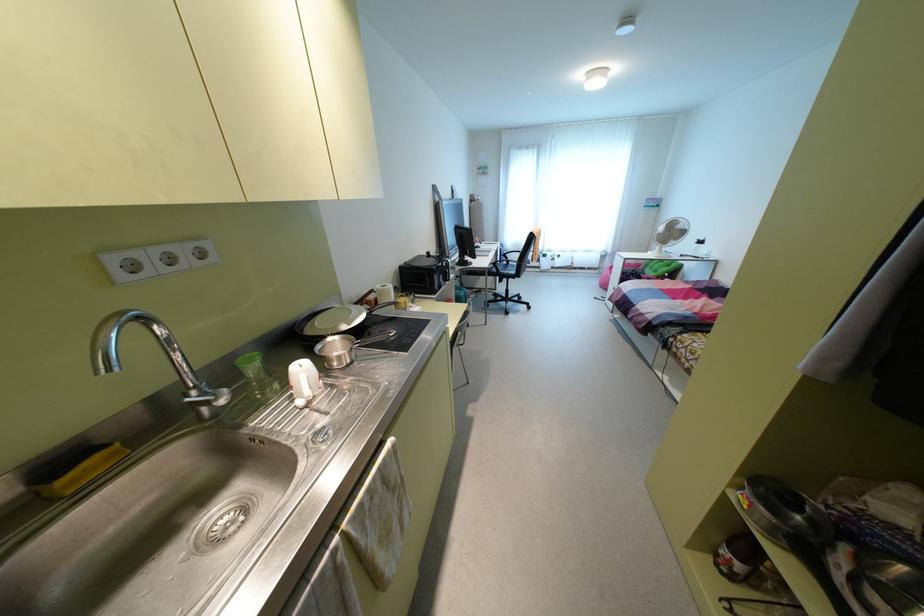
The image size is (924, 616). I want to click on yellow kitchen sponge, so click(x=79, y=469).